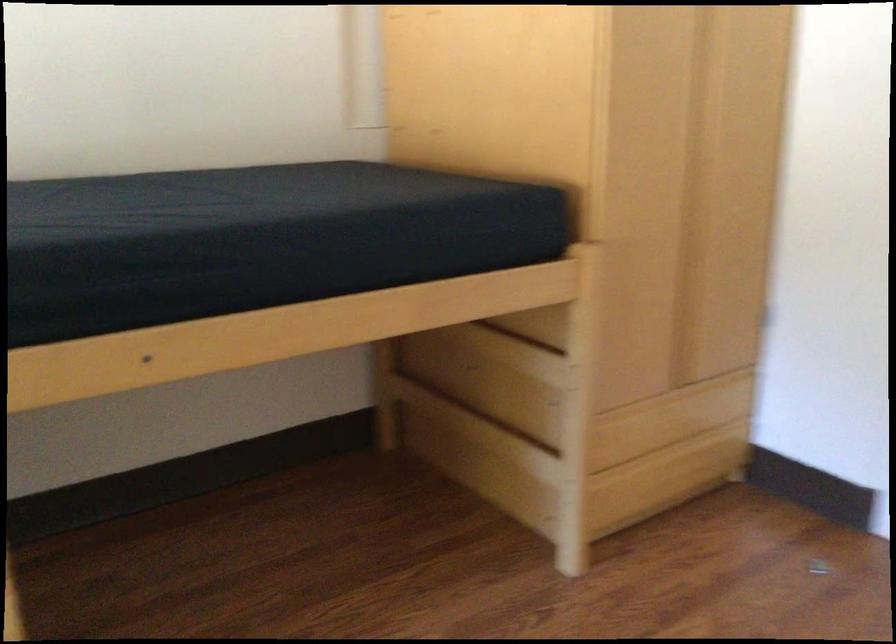
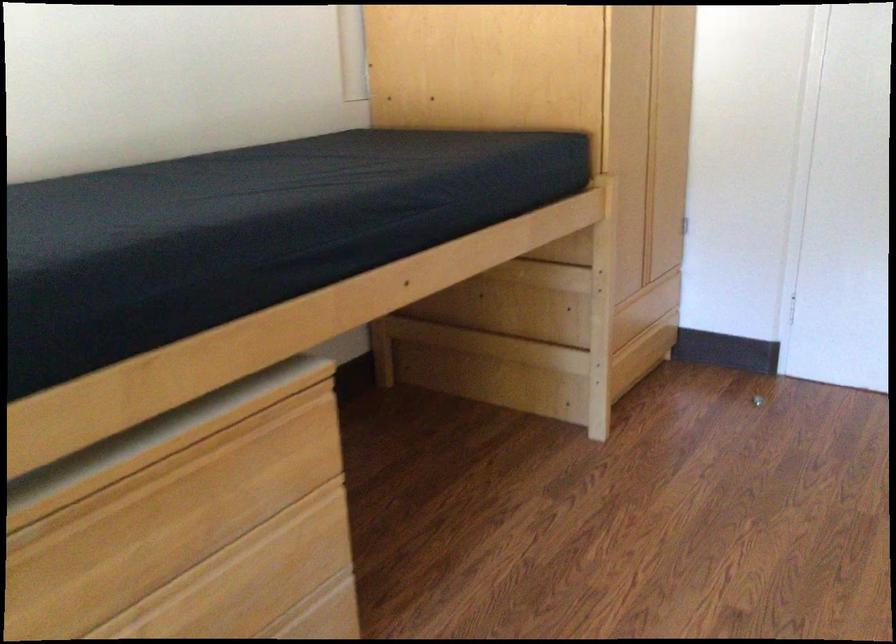
Where in the second image is the point corresponding to pixel 691 229 from the first image?

(648, 160)